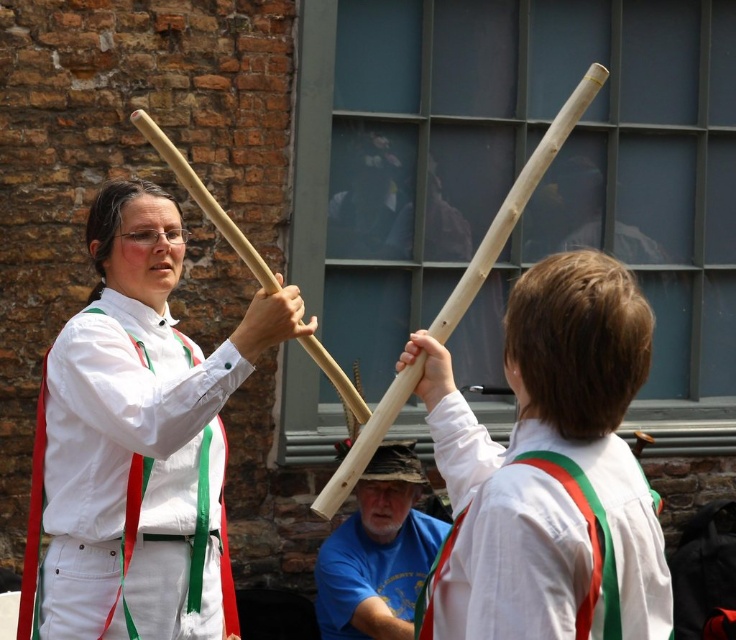
You are an observer watching a traditional ceremony. You notice two items in the image, the matte wood stick at center and the white cotton shirt at upper right. Which item is taller?

The matte wood stick at center is much taller than the white cotton shirt at upper right.